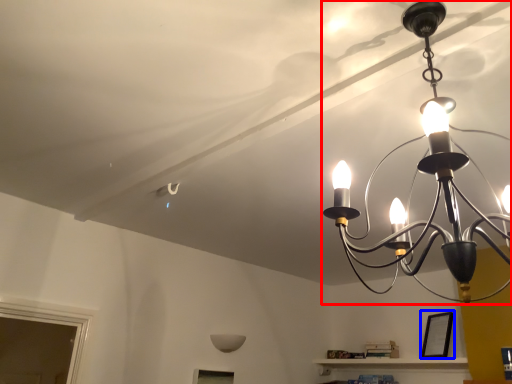
Question: Which point is closer to the camera, lamp (highlighted by a red box) or picture frame (highlighted by a blue box)?

Choices:
 (A) lamp
 (B) picture frame

Answer: (A)